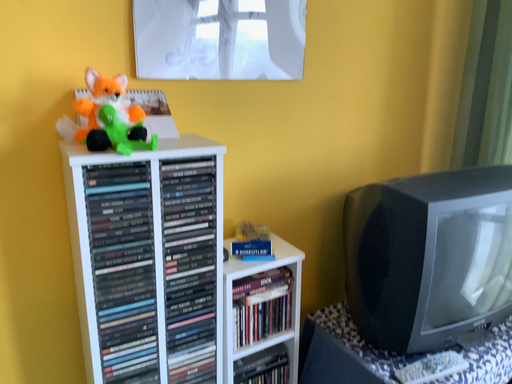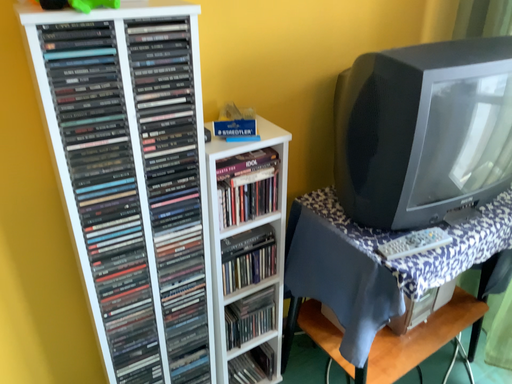
Question: Which way did the camera rotate in the video?

Choices:
 (A) rotated upward
 (B) rotated downward

Answer: (B)